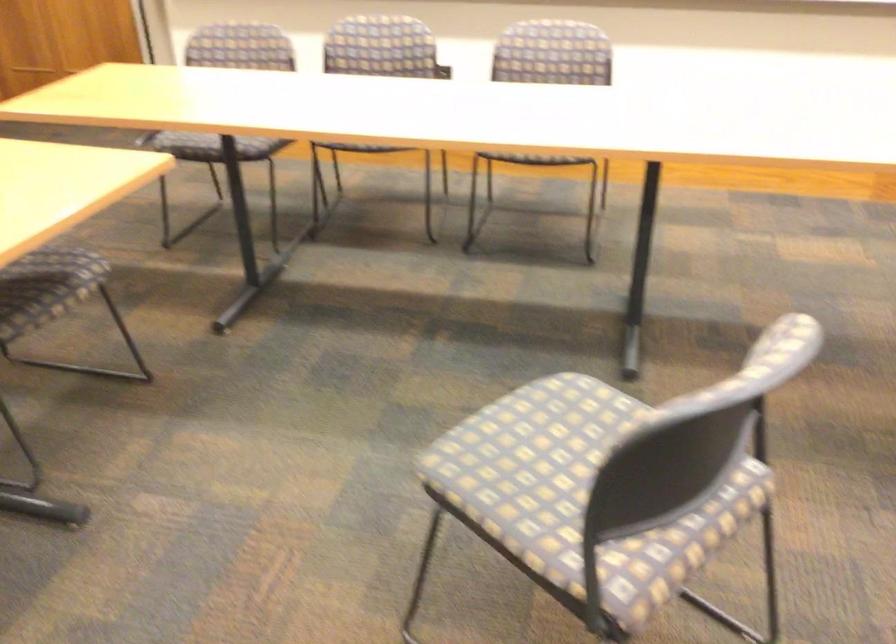
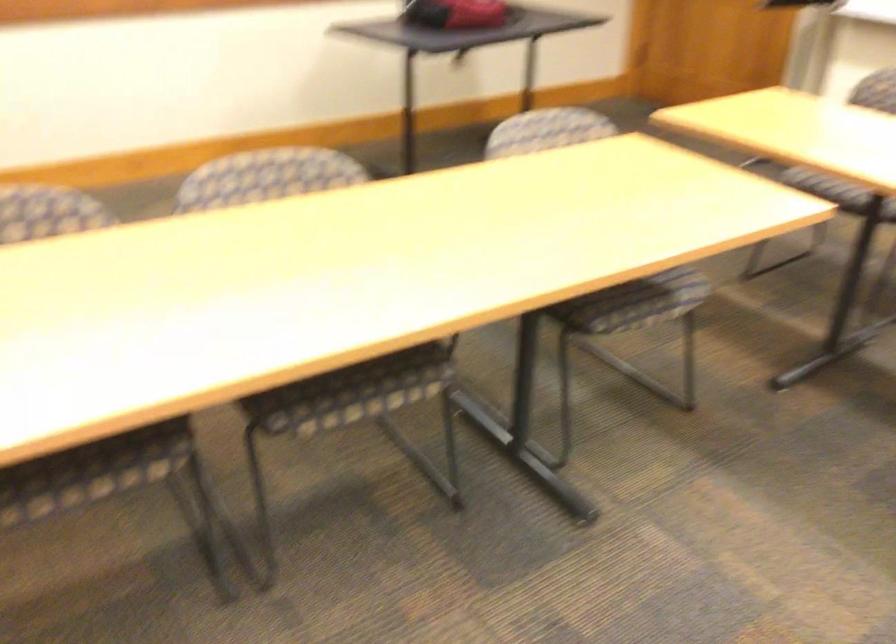
Where in the second image is the point corresponding to [202,143] from the first image?

(837, 192)